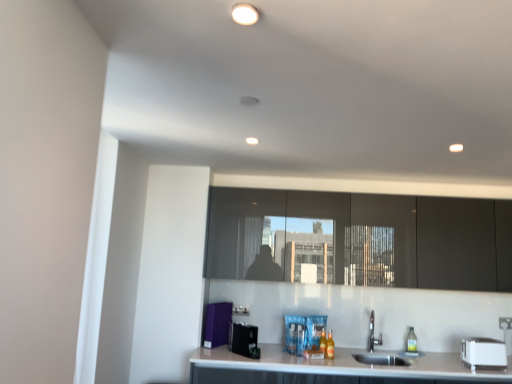
Question: Considering the relative sizes of white plastic toaster at lower right, the 1th appliance when ordered from right to left, and white glossy light fixture at upper center in the image provided, is white plastic toaster at lower right, the 1th appliance when ordered from right to left, smaller than white glossy light fixture at upper center?

Choices:
 (A) yes
 (B) no

Answer: (B)

Question: Are white plastic toaster at lower right, the 1th appliance when ordered from right to left, and white glossy light fixture at upper center far apart?

Choices:
 (A) no
 (B) yes

Answer: (B)

Question: From the image's perspective, would you say white plastic toaster at lower right, arranged as the 3th appliance when viewed from the left, is positioned over white glossy light fixture at upper center?

Choices:
 (A) no
 (B) yes

Answer: (A)

Question: From the image's perspective, does white plastic toaster at lower right, arranged as the 3th appliance when viewed from the left, appear lower than white glossy light fixture at upper center?

Choices:
 (A) yes
 (B) no

Answer: (A)

Question: Is white plastic toaster at lower right, arranged as the 3th appliance when viewed from the left, positioned beyond the bounds of white glossy light fixture at upper center?

Choices:
 (A) no
 (B) yes

Answer: (B)

Question: From a real-world perspective, is white plastic toaster at lower right, the 1th appliance when ordered from right to left, under white glossy light fixture at upper center?

Choices:
 (A) no
 (B) yes

Answer: (B)

Question: Is white glossy light fixture at upper center at the left side of white plastic toaster at lower right, the 1th appliance when ordered from right to left?

Choices:
 (A) no
 (B) yes

Answer: (B)

Question: Is white glossy light fixture at upper center outside of white plastic toaster at lower right, arranged as the 3th appliance when viewed from the left?

Choices:
 (A) no
 (B) yes

Answer: (B)

Question: Is white plastic toaster at lower right, the 1th appliance when ordered from right to left, located within white glossy light fixture at upper center?

Choices:
 (A) yes
 (B) no

Answer: (B)

Question: Considering the relative sizes of white glossy light fixture at upper center and white plastic toaster at lower right, the 1th appliance when ordered from right to left, in the image provided, is white glossy light fixture at upper center thinner than white plastic toaster at lower right, the 1th appliance when ordered from right to left,?

Choices:
 (A) no
 (B) yes

Answer: (B)

Question: Considering the relative sizes of white glossy light fixture at upper center and white plastic toaster at lower right, the 1th appliance when ordered from right to left, in the image provided, is white glossy light fixture at upper center bigger than white plastic toaster at lower right, the 1th appliance when ordered from right to left,?

Choices:
 (A) no
 (B) yes

Answer: (A)

Question: From the image's perspective, is white glossy light fixture at upper center over white plastic toaster at lower right, the 1th appliance when ordered from right to left?

Choices:
 (A) no
 (B) yes

Answer: (B)

Question: Is white plastic toaster at lower right, the 1th appliance when ordered from right to left, far from matte black cabinets at center?

Choices:
 (A) no
 (B) yes

Answer: (A)